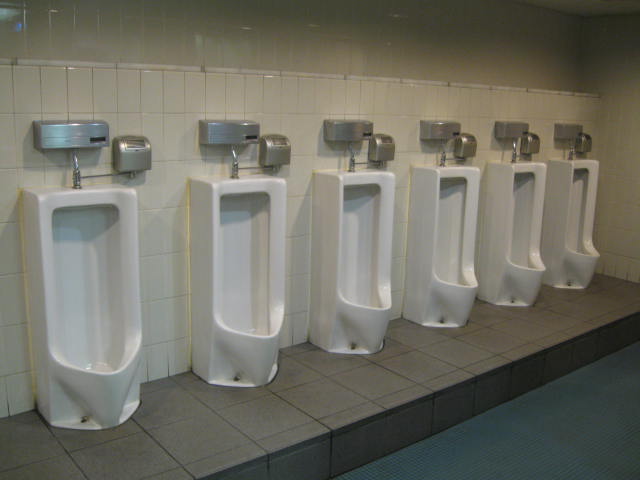
You are a GUI agent. You are given a task and a screenshot of the screen. Output one action in this format:
    pyautogui.click(x=<x>, y=<y>)
    Task: Click on the first 4 urinals from the left
    
    Given the screenshot: What is the action you would take?
    pyautogui.click(x=112, y=336), pyautogui.click(x=234, y=301), pyautogui.click(x=354, y=284), pyautogui.click(x=450, y=284)